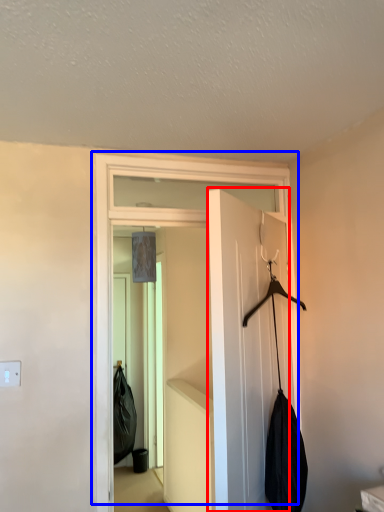
Question: Which object appears closest to the camera in this image, door (highlighted by a red box) or door (highlighted by a blue box)?

Choices:
 (A) door
 (B) door

Answer: (A)